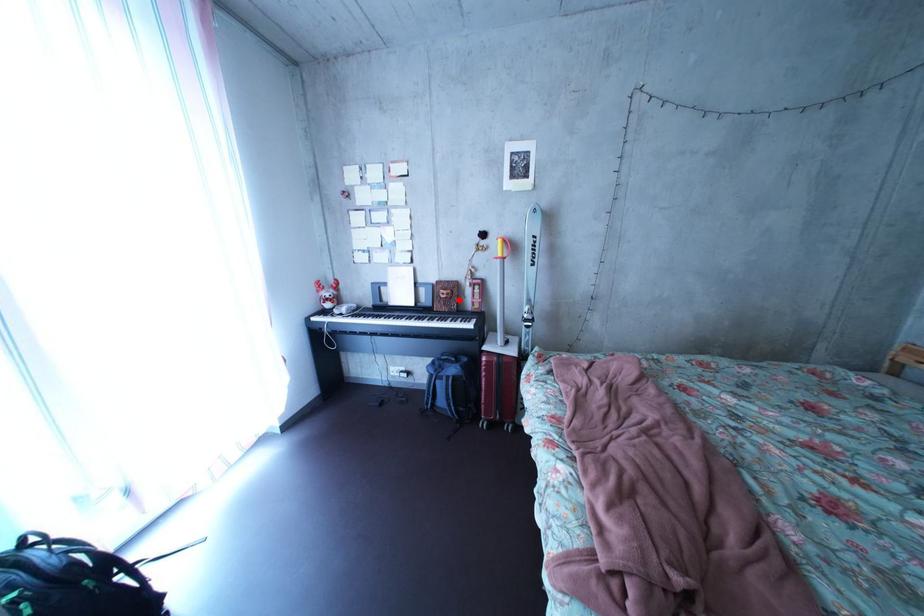
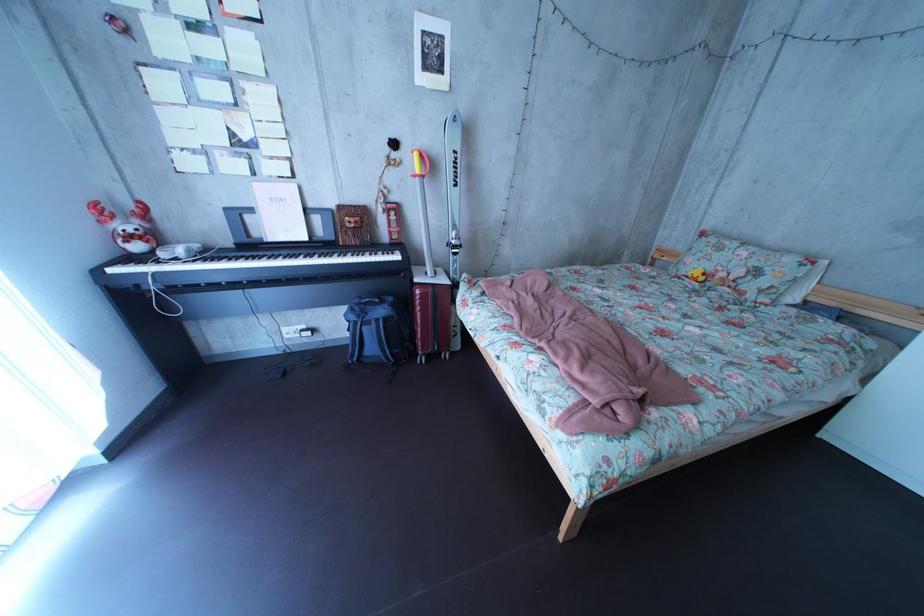
Question: I am providing you with two images of the same scene from different viewpoints. In image1, a red point is highlighted. Considering the same 3D point in image2, which of the following is correct?

Choices:
 (A) It is closer
 (B) It is farther

Answer: (A)